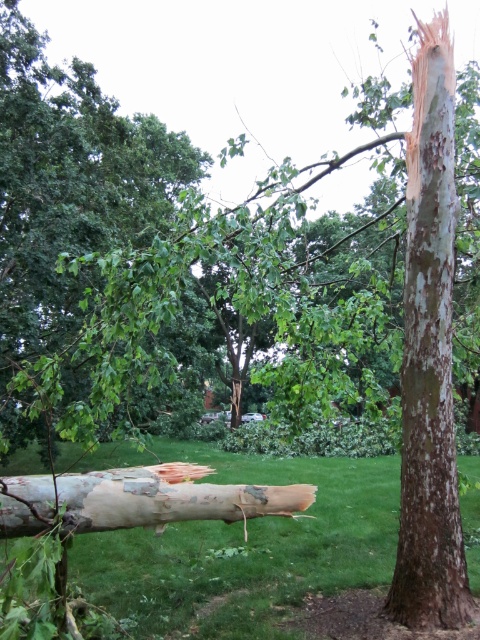
You are a park maintenance worker assessing the tree damage. You see the smooth brown bark at right and the white bark log at center. Which part of the tree is higher up?

The smooth brown bark at right is located above the white bark log at center, so the smooth brown bark at right is higher up.

You are planning to place a small garden ornament that requires a space wider than the smooth brown bark at right. Based on the scene, can the green grass at lower left accommodate this requirement?

The green grass at lower left has a greater width than the smooth brown bark at right, so it can accommodate the garden ornament requiring a space wider than the smooth brown bark at right.

You are a gardener who wants to plant a new flower bed. You have two options for locations in the image. The first is the green grass at lower left and the second is the white bark log at center. Which location would be more suitable for planting flowers, and why?

The green grass at lower left is more suitable for planting flowers because it has a greater height compared to the white bark log at center, indicating better soil depth and fertility for plant growth.